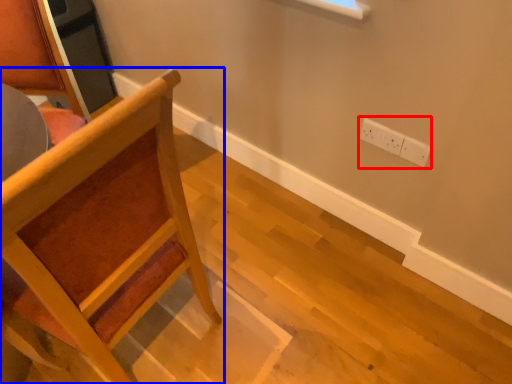
Question: Which of the following is the closest to the observer, electric outlet (highlighted by a red box) or chair (highlighted by a blue box)?

Choices:
 (A) electric outlet
 (B) chair

Answer: (B)